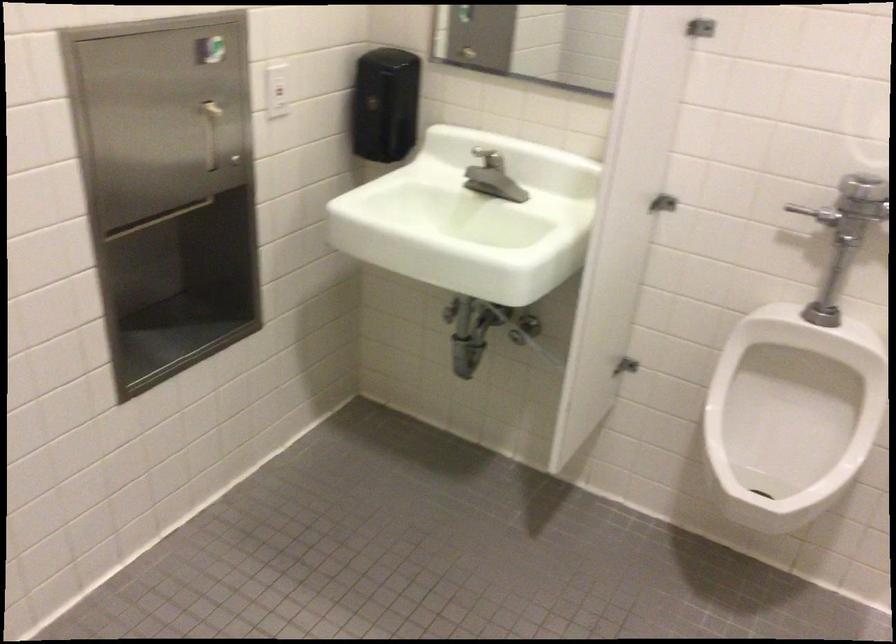
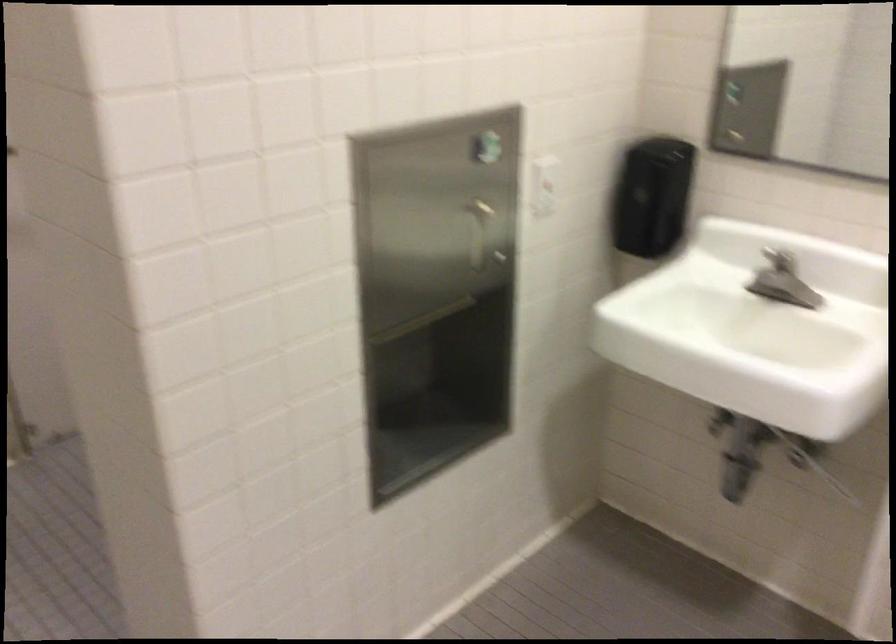
Question: The first image is from the beginning of the video and the second image is from the end. How did the camera likely rotate when shooting the video?

Choices:
 (A) Left
 (B) Right
 (C) Up
 (D) Down

Answer: (A)